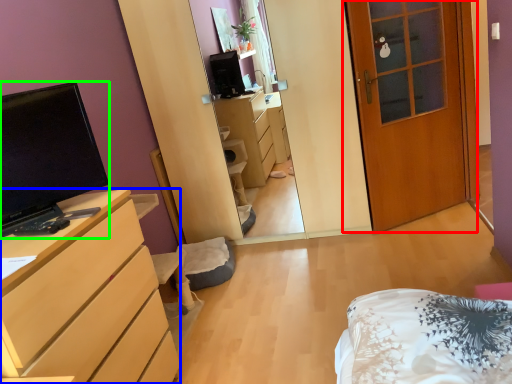
Question: Which object is positioned farthest from door (highlighted by a red box)? Select from cabinetry (highlighted by a blue box) and television (highlighted by a green box).

Choices:
 (A) cabinetry
 (B) television

Answer: (B)